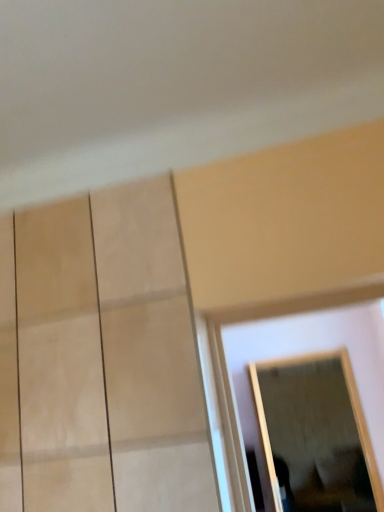
Image resolution: width=384 pixels, height=512 pixels. Describe the element at coordinates (315, 434) in the screenshot. I see `gold-framed mirror at right` at that location.

Locate an element on the screen. gold-framed mirror at right is located at coordinates (315, 434).

At what (x,y) coordinates should I click in order to perform the action: click on gold-framed mirror at right. Please return your answer as a coordinate pair (x, y). Looking at the image, I should click on [x=315, y=434].